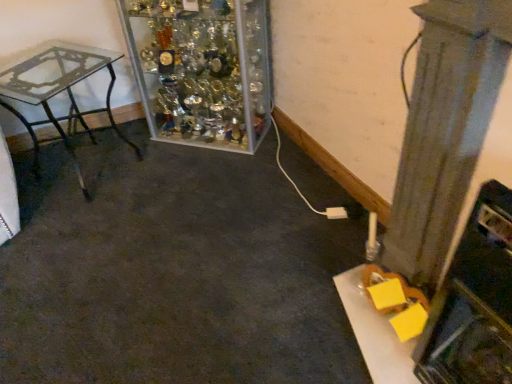
Question: Looking at the image, does clear glass table at left seem bigger or smaller compared to smooth gray pillar at right?

Choices:
 (A) big
 (B) small

Answer: (A)

Question: Is clear glass table at left wider or thinner than smooth gray pillar at right?

Choices:
 (A) thin
 (B) wide

Answer: (B)

Question: Based on their relative distances, which object is farther from the smooth gray pillar at right?

Choices:
 (A) clear glass trophy case at upper center
 (B) clear glass table at left

Answer: (B)

Question: Which is nearer to the clear glass trophy case at upper center?

Choices:
 (A) smooth gray pillar at right
 (B) clear glass table at left

Answer: (B)